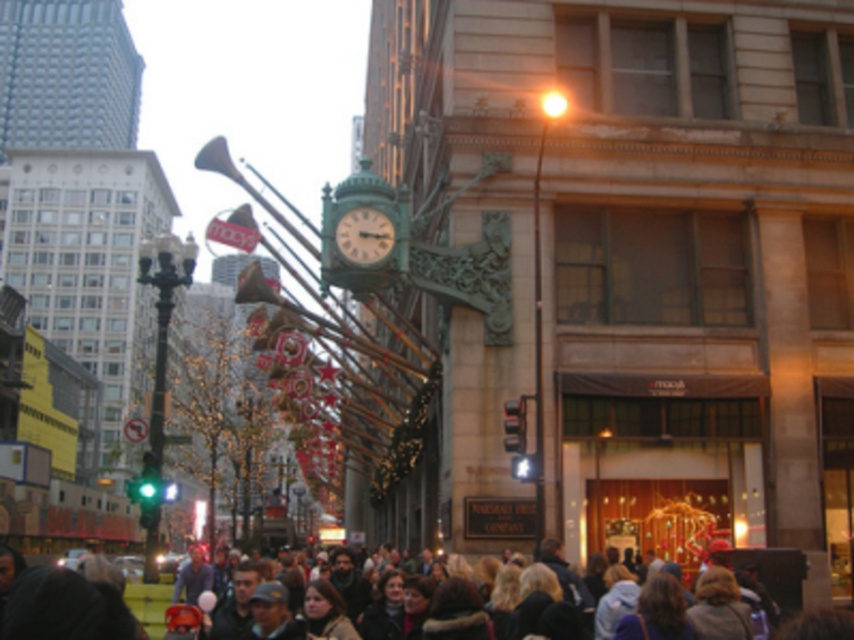
Question: Does dark brown hair at lower center appear on the left side of black metal pole at left?

Choices:
 (A) no
 (B) yes

Answer: (A)

Question: Which object is positioned farthest from the dark brown hair at lower center?

Choices:
 (A) black metal pole at left
 (B) green painted metal clock at center

Answer: (A)

Question: Does dark brown hair at lower center have a greater width compared to green painted metal clock at center?

Choices:
 (A) no
 (B) yes

Answer: (B)

Question: Considering the relative positions of black metal pole at left and green painted metal clock at center in the image provided, where is black metal pole at left located with respect to green painted metal clock at center?

Choices:
 (A) right
 (B) left

Answer: (B)

Question: Which of the following is the closest to the observer?

Choices:
 (A) green painted metal clock at center
 (B) dark brown hair at lower center

Answer: (B)

Question: Among these points, which one is farthest from the camera?

Choices:
 (A) (10, 614)
 (B) (159, 428)

Answer: (B)